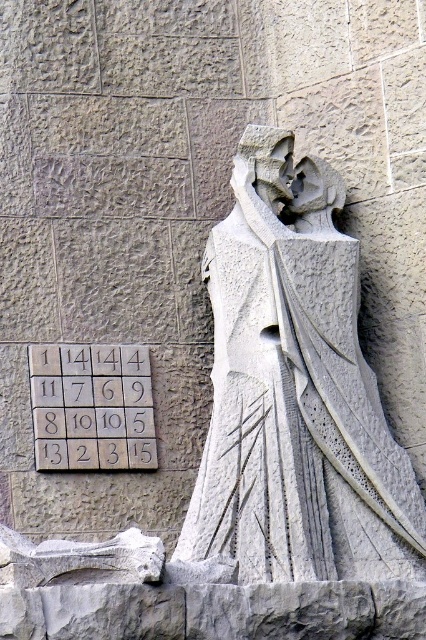
You are standing in front of the stone sculpture. There is a point marked at coordinates [294,392]. Based on the description, where is this point located on the sculpture?

The point is on the white stone statue at center, so it is located on the sculpture itself.

You are an art conservator examining the stone sculpture and tiles. Based on their positions, which object is closer to you? Please choose between the white stone statue at center and the white stone tiles at center.

The white stone statue at center is closer to you since it is positioned in front of the white stone tiles at center.